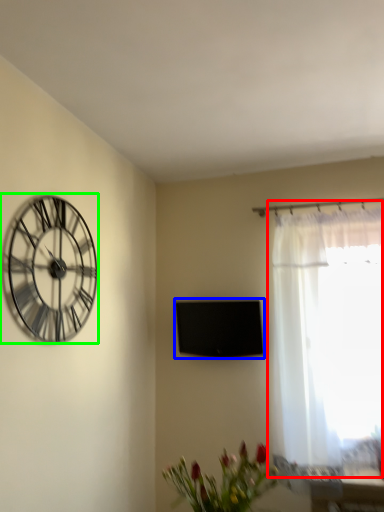
Question: Estimate the real-world distances between objects in this image. Which object is closer to window (highlighted by a red box), window screen (highlighted by a blue box) or wall clock (highlighted by a green box)?

Choices:
 (A) window screen
 (B) wall clock

Answer: (A)